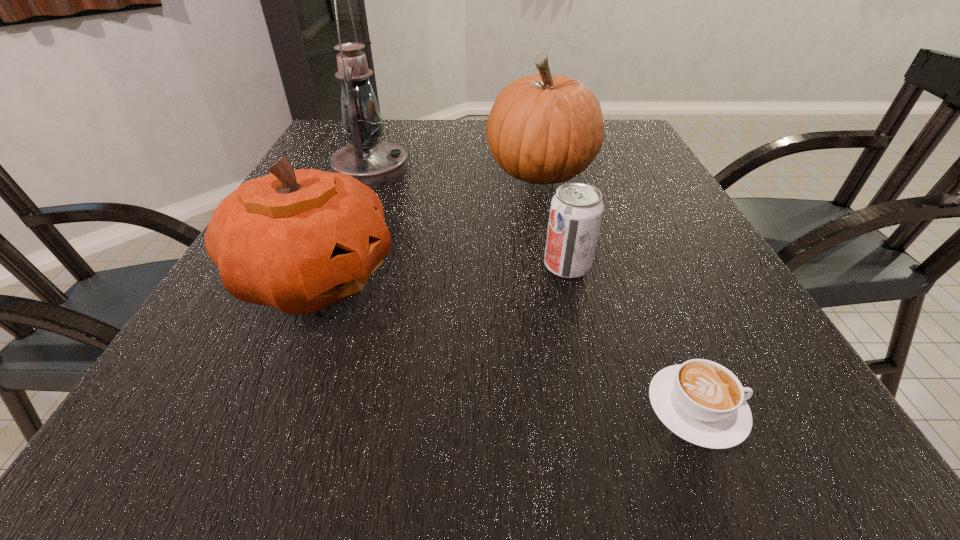
Identify the location of vacant space located on the stem of the taller pumpkin. Image resolution: width=960 pixels, height=540 pixels. (413, 173).

Identify the location of free space located 0.210m on the stem of the taller pumpkin. (401, 173).

Where is `free space located 0.350m on the front-facing side of the nearer pumpkin`? Image resolution: width=960 pixels, height=540 pixels. free space located 0.350m on the front-facing side of the nearer pumpkin is located at coordinates (588, 277).

Where is `vacant space located on the back of the soda can`? This screenshot has height=540, width=960. vacant space located on the back of the soda can is located at coordinates (559, 228).

Locate an element on the screen. This screenshot has height=540, width=960. free space located 0.060m on the side of the cappuccino with the handle is located at coordinates (788, 408).

Locate an element on the screen. Image resolution: width=960 pixels, height=540 pixels. oil lamp that is positioned at the far edge is located at coordinates (375, 163).

Where is `pumpkin situated at the far edge`? The height and width of the screenshot is (540, 960). pumpkin situated at the far edge is located at coordinates (543, 129).

Locate an element on the screen. object at the near edge is located at coordinates (701, 401).

Where is `oil lamp at the left edge`? oil lamp at the left edge is located at coordinates (375, 163).

This screenshot has width=960, height=540. Find the location of `pumpkin that is at the left edge`. pumpkin that is at the left edge is located at coordinates (300, 240).